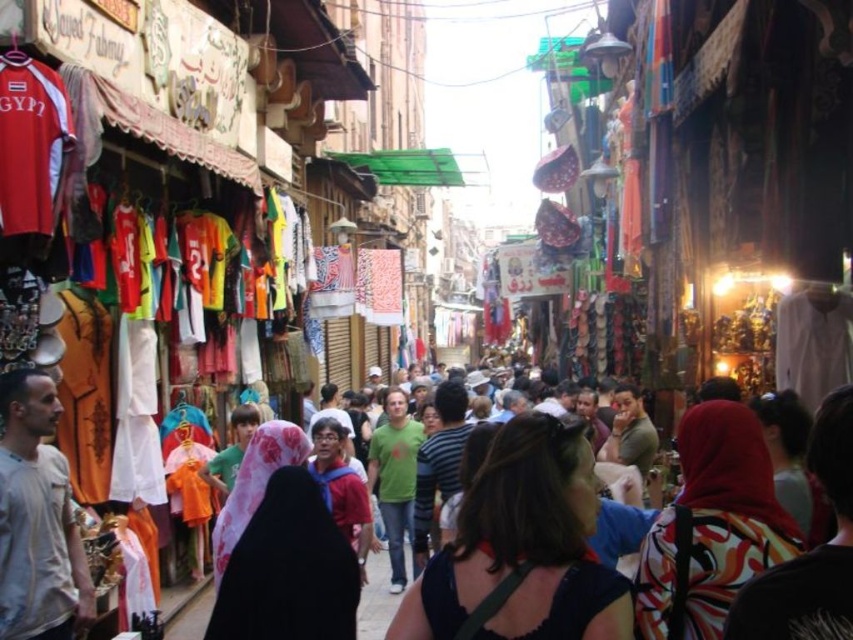
Can you confirm if printed fabric headscarf at center is positioned below green matte shirt at center?

No, printed fabric headscarf at center is not below green matte shirt at center.

Is printed fabric headscarf at center closer to camera compared to green matte shirt at center?

Yes.

Is point (802, 620) closer to viewer compared to point (384, 404)?

Yes, point (802, 620) is closer to viewer.

The image size is (853, 640). Find the location of `printed fabric headscarf at center`. printed fabric headscarf at center is located at coordinates (809, 550).

How far apart are printed silk scarf at center and green matte shirt at center?

printed silk scarf at center is 24.51 meters from green matte shirt at center.

Between printed silk scarf at center and green matte shirt at center, which one has less height?

With less height is printed silk scarf at center.

Who is more distant from viewer, (706,563) or (396,486)?

Point (396,486)

The height and width of the screenshot is (640, 853). Find the location of `printed silk scarf at center`. printed silk scarf at center is located at coordinates (712, 525).

Who is positioned more to the right, printed silk scarf at center or printed fabric headscarf at center?

printed fabric headscarf at center is more to the right.

Which is in front, point (746, 452) or point (849, 417)?

Point (849, 417) is in front.

The height and width of the screenshot is (640, 853). Find the location of `printed silk scarf at center`. printed silk scarf at center is located at coordinates (712, 525).